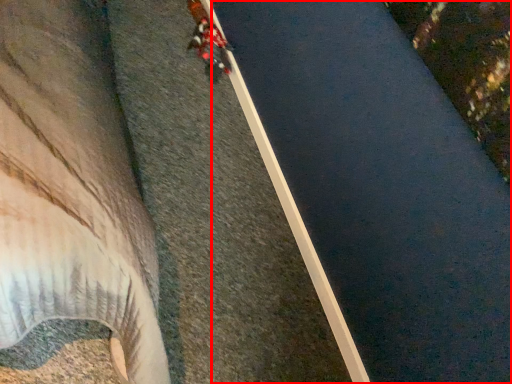
Question: Observing the image, what is the correct spatial positioning of waterway (annotated by the red box) in reference to person?

Choices:
 (A) left
 (B) right

Answer: (B)